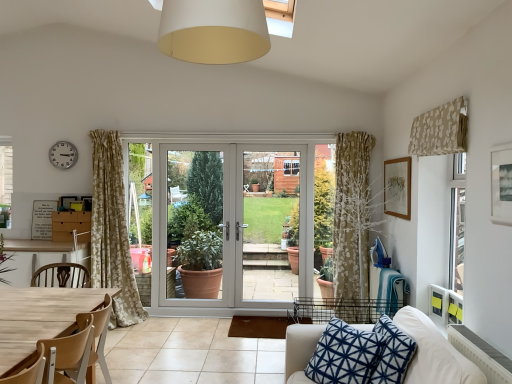
Identify the location of free space above matte white screen door at center, which is the 1th screen door in left-to-right order (from a real-world perspective). The image size is (512, 384). (194, 144).